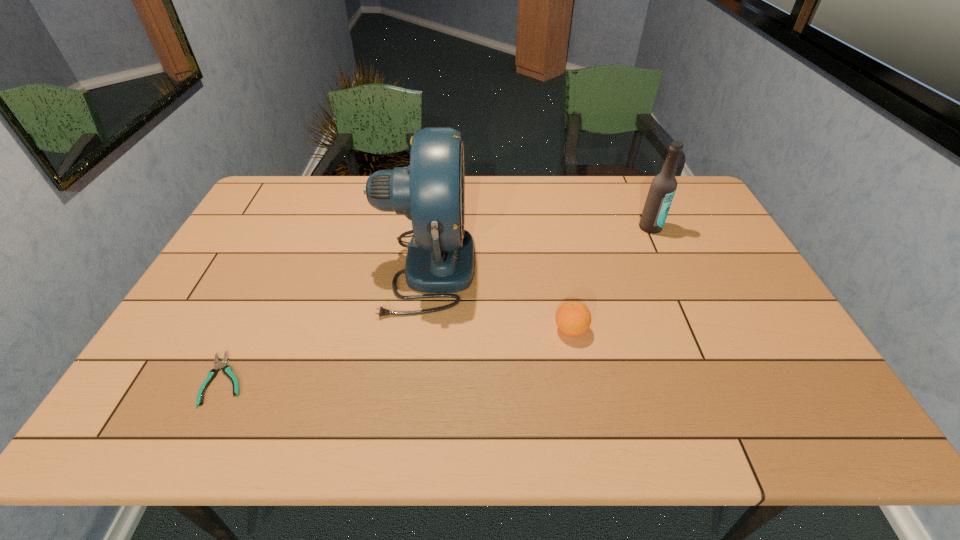
This screenshot has width=960, height=540. I want to click on object that stands as the second closest to the fan, so click(226, 369).

At what (x,y) coordinates should I click in order to perform the action: click on free location that satisfies the following two spatial constraints: 1. on the label of the third shortest object; 2. in front of the third object from right to left to blow air. Please return your answer as a coordinate pair (x, y). Looking at the image, I should click on (668, 268).

Where is `vacant space that satisfies the following two spatial constraints: 1. on the label of the rightmost object; 2. in front of the fan to blow air`? The image size is (960, 540). vacant space that satisfies the following two spatial constraints: 1. on the label of the rightmost object; 2. in front of the fan to blow air is located at coordinates (668, 268).

Identify the location of free point that satisfies the following two spatial constraints: 1. in front of the tallest object to blow air; 2. on the front side of the pliers. Image resolution: width=960 pixels, height=540 pixels. (412, 379).